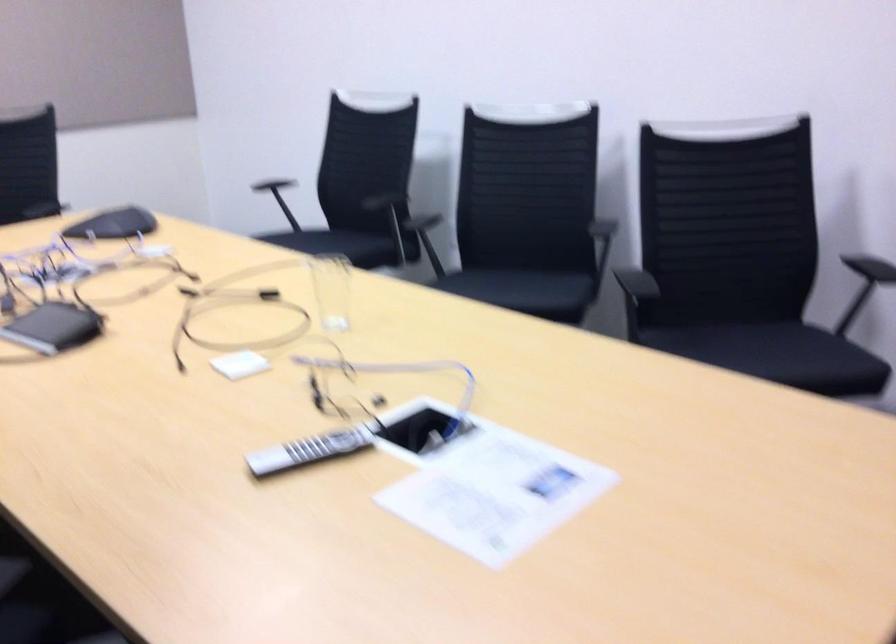
The height and width of the screenshot is (644, 896). In order to click on black electronic device in this screenshot , I will do `click(53, 327)`.